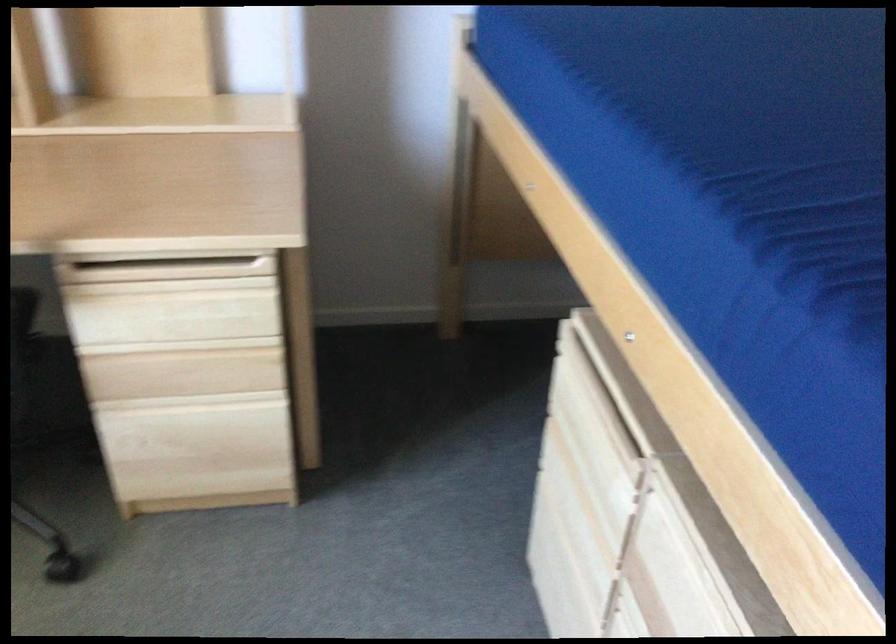
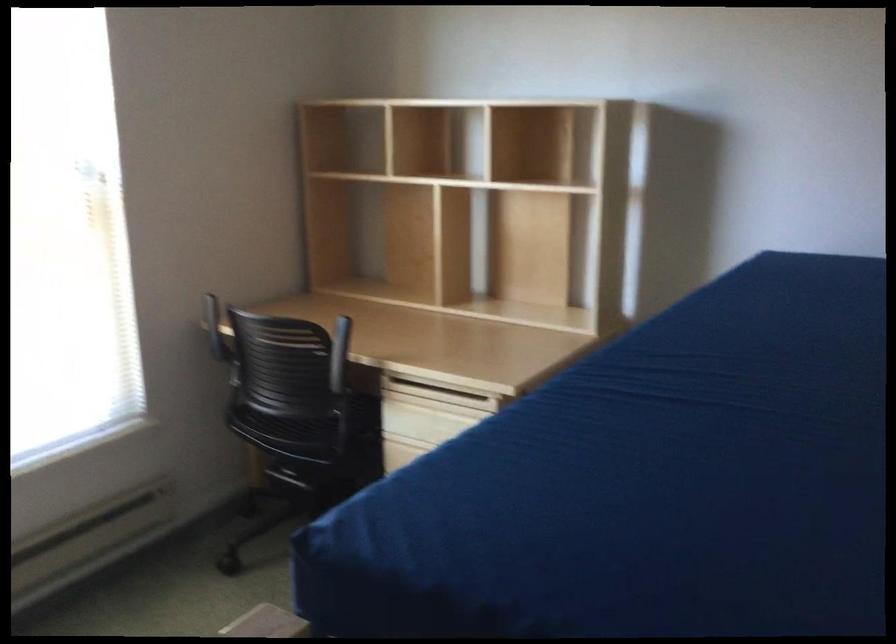
Question: I am providing you with two images of the same scene from different viewpoints. Please identify which objects are invisible in image2.

Choices:
 (A) brown cardboard tube
 (B) black chair armrest
 (C) light wood drawer handle
 (D) black chair sitting surface

Answer: (C)